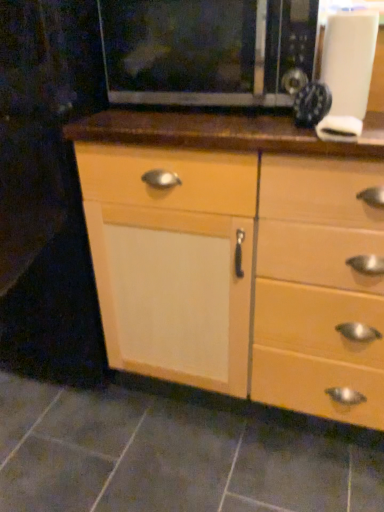
Question: Is white matte knob at upper right facing away from black matte microwave at upper center?

Choices:
 (A) yes
 (B) no

Answer: (B)

Question: Can you confirm if white matte knob at upper right is thinner than black matte microwave at upper center?

Choices:
 (A) yes
 (B) no

Answer: (A)

Question: Considering the relative sizes of white matte knob at upper right and black matte microwave at upper center in the image provided, is white matte knob at upper right wider than black matte microwave at upper center?

Choices:
 (A) no
 (B) yes

Answer: (A)

Question: Is the position of white matte knob at upper right less distant than that of black matte microwave at upper center?

Choices:
 (A) no
 (B) yes

Answer: (B)

Question: From a real-world perspective, is white matte knob at upper right physically below black matte microwave at upper center?

Choices:
 (A) yes
 (B) no

Answer: (A)

Question: From the image's perspective, is metallic black clock at upper right located above or below black matte microwave at upper center?

Choices:
 (A) above
 (B) below

Answer: (B)

Question: In the image, is metallic black clock at upper right on the left side or the right side of black matte microwave at upper center?

Choices:
 (A) right
 (B) left

Answer: (A)

Question: From their relative heights in the image, would you say metallic black clock at upper right is taller or shorter than black matte microwave at upper center?

Choices:
 (A) tall
 (B) short

Answer: (B)

Question: Is metallic black clock at upper right inside the boundaries of black matte microwave at upper center, or outside?

Choices:
 (A) outside
 (B) inside

Answer: (A)

Question: Is black matte microwave at upper center bigger or smaller than white matte knob at upper right?

Choices:
 (A) small
 (B) big

Answer: (B)

Question: From the image's perspective, is black matte microwave at upper center above or below white matte knob at upper right?

Choices:
 (A) above
 (B) below

Answer: (A)

Question: In the image, is black matte microwave at upper center positioned in front of or behind white matte knob at upper right?

Choices:
 (A) behind
 (B) front

Answer: (A)

Question: From a real-world perspective, is black matte microwave at upper center above or below white matte knob at upper right?

Choices:
 (A) below
 (B) above

Answer: (B)

Question: From a real-world perspective, is white matte knob at upper right above or below black matte microwave at upper center?

Choices:
 (A) above
 (B) below

Answer: (B)

Question: Relative to black matte microwave at upper center, is white matte knob at upper right in front or behind?

Choices:
 (A) behind
 (B) front

Answer: (B)